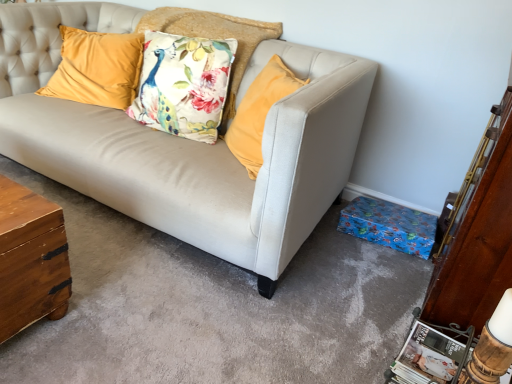
What do you see at coordinates (97, 68) in the screenshot?
I see `velvet yellow pillow at upper left, marked as the 2th pillow in a right-to-left arrangement` at bounding box center [97, 68].

The width and height of the screenshot is (512, 384). I want to click on velvet yellow pillow at upper left, marked as the 2th pillow in a right-to-left arrangement, so click(x=97, y=68).

The image size is (512, 384). What do you see at coordinates (214, 38) in the screenshot?
I see `floral fabric cushion at center, which is the 1th pillow in right-to-left order` at bounding box center [214, 38].

Identify the location of floral fabric cushion at center, which is the 1th pillow in right-to-left order. (214, 38).

Measure the distance between point (240, 57) and camera.

Point (240, 57) is 7.00 feet away from camera.

You are a GUI agent. You are given a task and a screenshot of the screen. Output one action in this format:
    pyautogui.click(x=<x>, y=<y>)
    Task: Click on the velvet yellow pillow at upper left, marked as the 2th pillow in a right-to-left arrangement
    
    Given the screenshot: What is the action you would take?
    pyautogui.click(x=97, y=68)

Can you confirm if floral fabric cushion at center, placed as the 2th pillow when sorted from left to right, is positioned to the right of velvet yellow pillow at upper left, the first pillow when ordered from left to right?

Indeed, floral fabric cushion at center, placed as the 2th pillow when sorted from left to right, is positioned on the right side of velvet yellow pillow at upper left, the first pillow when ordered from left to right.

Which object is further away from the camera taking this photo, floral fabric cushion at center, which is the 1th pillow in right-to-left order, or velvet yellow pillow at upper left, the first pillow when ordered from left to right?

Positioned behind is velvet yellow pillow at upper left, the first pillow when ordered from left to right.

Is point (172, 27) less distant than point (86, 41)?

Yes, point (172, 27) is in front of point (86, 41).

Based on the photo, from the image's perspective, relative to velvet yellow pillow at upper left, marked as the 2th pillow in a right-to-left arrangement, is floral fabric cushion at center, placed as the 2th pillow when sorted from left to right, above or below?

From the image's perspective, floral fabric cushion at center, placed as the 2th pillow when sorted from left to right, appears above velvet yellow pillow at upper left, marked as the 2th pillow in a right-to-left arrangement.

From the picture: From a real-world perspective, does floral fabric cushion at center, placed as the 2th pillow when sorted from left to right, sit lower than velvet yellow pillow at upper left, marked as the 2th pillow in a right-to-left arrangement?

No, from a real-world perspective, floral fabric cushion at center, placed as the 2th pillow when sorted from left to right, is not beneath velvet yellow pillow at upper left, marked as the 2th pillow in a right-to-left arrangement.

Considering the sizes of objects floral fabric cushion at center, placed as the 2th pillow when sorted from left to right, and velvet yellow pillow at upper left, the first pillow when ordered from left to right, in the image provided, who is wider, floral fabric cushion at center, placed as the 2th pillow when sorted from left to right, or velvet yellow pillow at upper left, the first pillow when ordered from left to right,?

floral fabric cushion at center, placed as the 2th pillow when sorted from left to right.

Considering the relative sizes of floral fabric cushion at center, placed as the 2th pillow when sorted from left to right, and velvet yellow pillow at upper left, the first pillow when ordered from left to right, in the image provided, is floral fabric cushion at center, placed as the 2th pillow when sorted from left to right, shorter than velvet yellow pillow at upper left, the first pillow when ordered from left to right,?

Incorrect, the height of floral fabric cushion at center, placed as the 2th pillow when sorted from left to right, does not fall short of that of velvet yellow pillow at upper left, the first pillow when ordered from left to right.

Between floral fabric cushion at center, placed as the 2th pillow when sorted from left to right, and velvet yellow pillow at upper left, marked as the 2th pillow in a right-to-left arrangement, which one has larger size?

With larger size is floral fabric cushion at center, placed as the 2th pillow when sorted from left to right.

Is floral fabric cushion at center, which is the 1th pillow in right-to-left order, completely or partially outside of velvet yellow pillow at upper left, the first pillow when ordered from left to right?

Yes, floral fabric cushion at center, which is the 1th pillow in right-to-left order, is not within velvet yellow pillow at upper left, the first pillow when ordered from left to right.

Is floral fabric cushion at center, placed as the 2th pillow when sorted from left to right, in contact with velvet yellow pillow at upper left, marked as the 2th pillow in a right-to-left arrangement?

No, floral fabric cushion at center, placed as the 2th pillow when sorted from left to right, is not touching velvet yellow pillow at upper left, marked as the 2th pillow in a right-to-left arrangement.

Is velvet yellow pillow at upper left, the first pillow when ordered from left to right, at the back of floral fabric cushion at center, which is the 1th pillow in right-to-left order?

No, floral fabric cushion at center, which is the 1th pillow in right-to-left order, is not facing the opposite direction of velvet yellow pillow at upper left, the first pillow when ordered from left to right.

What's the angular difference between floral fabric cushion at center, placed as the 2th pillow when sorted from left to right, and velvet yellow pillow at upper left, the first pillow when ordered from left to right,'s facing directions?

14.2 degrees.

Identify the location of pillow located above the velvet yellow pillow at upper left, the first pillow when ordered from left to right (from the image's perspective). (214, 38).

Which is more to the right, velvet yellow pillow at upper left, the first pillow when ordered from left to right, or floral fabric cushion at center, which is the 1th pillow in right-to-left order?

floral fabric cushion at center, which is the 1th pillow in right-to-left order.

Considering the positions of objects velvet yellow pillow at upper left, marked as the 2th pillow in a right-to-left arrangement, and floral fabric cushion at center, which is the 1th pillow in right-to-left order, in the image provided, who is behind, velvet yellow pillow at upper left, marked as the 2th pillow in a right-to-left arrangement, or floral fabric cushion at center, which is the 1th pillow in right-to-left order,?

velvet yellow pillow at upper left, marked as the 2th pillow in a right-to-left arrangement.

Does point (104, 70) come behind point (169, 13)?

No, (104, 70) is in front of (169, 13).

From the image's perspective, is velvet yellow pillow at upper left, marked as the 2th pillow in a right-to-left arrangement, above floral fabric cushion at center, which is the 1th pillow in right-to-left order?

No, from the image's perspective, velvet yellow pillow at upper left, marked as the 2th pillow in a right-to-left arrangement, is not on top of floral fabric cushion at center, which is the 1th pillow in right-to-left order.

From the picture: From a real-world perspective, is velvet yellow pillow at upper left, marked as the 2th pillow in a right-to-left arrangement, above or below floral fabric cushion at center, placed as the 2th pillow when sorted from left to right?

In terms of real-world spatial position, velvet yellow pillow at upper left, marked as the 2th pillow in a right-to-left arrangement, is below floral fabric cushion at center, placed as the 2th pillow when sorted from left to right.

In terms of width, does velvet yellow pillow at upper left, the first pillow when ordered from left to right, look wider or thinner when compared to floral fabric cushion at center, placed as the 2th pillow when sorted from left to right?

In the image, velvet yellow pillow at upper left, the first pillow when ordered from left to right, appears to be more narrow than floral fabric cushion at center, placed as the 2th pillow when sorted from left to right.

In terms of height, does velvet yellow pillow at upper left, the first pillow when ordered from left to right, look taller or shorter compared to floral fabric cushion at center, which is the 1th pillow in right-to-left order?

Considering their sizes, velvet yellow pillow at upper left, the first pillow when ordered from left to right, has less height than floral fabric cushion at center, which is the 1th pillow in right-to-left order.

Considering the sizes of objects velvet yellow pillow at upper left, marked as the 2th pillow in a right-to-left arrangement, and floral fabric cushion at center, placed as the 2th pillow when sorted from left to right, in the image provided, who is bigger, velvet yellow pillow at upper left, marked as the 2th pillow in a right-to-left arrangement, or floral fabric cushion at center, placed as the 2th pillow when sorted from left to right,?

floral fabric cushion at center, placed as the 2th pillow when sorted from left to right.

Which is correct: velvet yellow pillow at upper left, marked as the 2th pillow in a right-to-left arrangement, is inside floral fabric cushion at center, which is the 1th pillow in right-to-left order, or outside of it?

velvet yellow pillow at upper left, marked as the 2th pillow in a right-to-left arrangement, lies outside floral fabric cushion at center, which is the 1th pillow in right-to-left order.

Consider the image. Does velvet yellow pillow at upper left, marked as the 2th pillow in a right-to-left arrangement, turn towards floral fabric cushion at center, placed as the 2th pillow when sorted from left to right?

No.

How different are the orientations of velvet yellow pillow at upper left, the first pillow when ordered from left to right, and floral fabric cushion at center, placed as the 2th pillow when sorted from left to right, in degrees?

The angular difference between velvet yellow pillow at upper left, the first pillow when ordered from left to right, and floral fabric cushion at center, placed as the 2th pillow when sorted from left to right, is 14.2 degrees.

In the scene shown: Could you measure the distance between velvet yellow pillow at upper left, marked as the 2th pillow in a right-to-left arrangement, and floral fabric cushion at center, placed as the 2th pillow when sorted from left to right?

14.32 inches.

I want to click on pillow in front of the velvet yellow pillow at upper left, the first pillow when ordered from left to right, so click(x=214, y=38).

The width and height of the screenshot is (512, 384). In order to click on pillow located underneath the floral fabric cushion at center, which is the 1th pillow in right-to-left order (from a real-world perspective) in this screenshot , I will do `click(97, 68)`.

Locate an element on the screen. The width and height of the screenshot is (512, 384). pillow in front of the velvet yellow pillow at upper left, marked as the 2th pillow in a right-to-left arrangement is located at coordinates (214, 38).